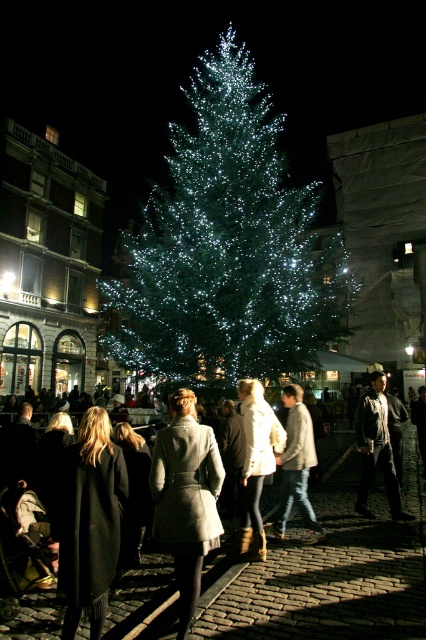
You are standing in the crowd around the Christmas tree and notice two people wearing coats. One has a black wool coat at center and the other has a light brown leather jacket at center. Which person is standing closer to the ground?

The black wool coat at center is located below the light brown leather jacket at center, so the person wearing the black wool coat at center is standing closer to the ground.

You are standing in the plaza and want to take a photo of the illuminated green pine at center and the gray wool coat at center. Which object should you focus on first to ensure both are in frame?

You should focus on the gray wool coat at center first because it is closer to you than the illuminated green pine at center, which is above it.